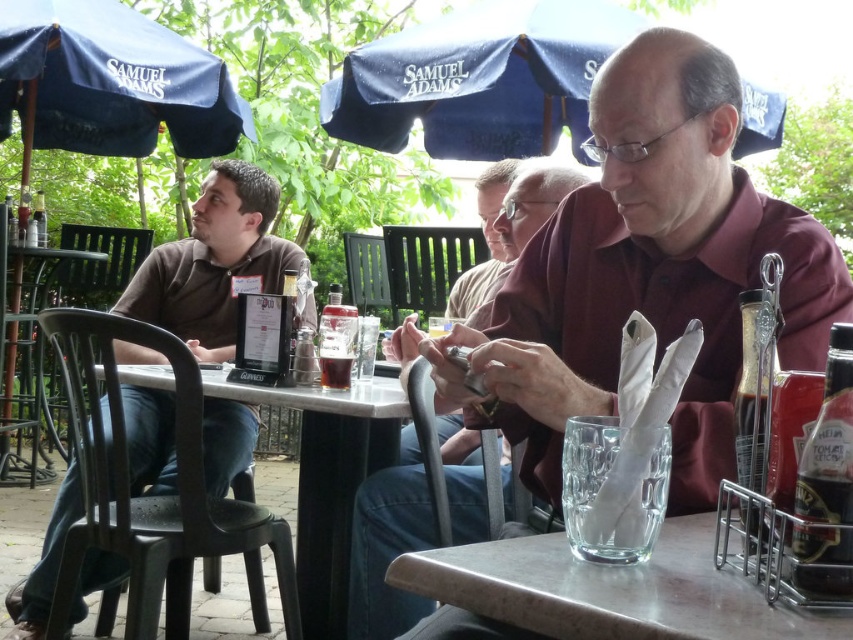
Question: Estimate the real-world distances between objects in this image. Which object is farther from the clear glass water at lower center?

Choices:
 (A) maroon shirt at center
 (B) blue fabric umbrella at upper center
 (C) white plastic table at center
 (D) matte brown shirt at center

Answer: (B)

Question: Is brown cotton shirt at left smaller than white plastic table at center?

Choices:
 (A) yes
 (B) no

Answer: (B)

Question: Is matte brown shirt at center positioned in front of black plastic chair at left?

Choices:
 (A) yes
 (B) no

Answer: (A)

Question: Which of these objects is positioned farthest from the brown cotton shirt at left?

Choices:
 (A) white plastic table at center
 (B) clear glass water at lower center

Answer: (B)

Question: Can you confirm if blue fabric umbrella at upper center is wider than matte brown shirt at center?

Choices:
 (A) yes
 (B) no

Answer: (A)

Question: Which point is closer to the camera?

Choices:
 (A) (370, 74)
 (B) (148, 61)

Answer: (A)